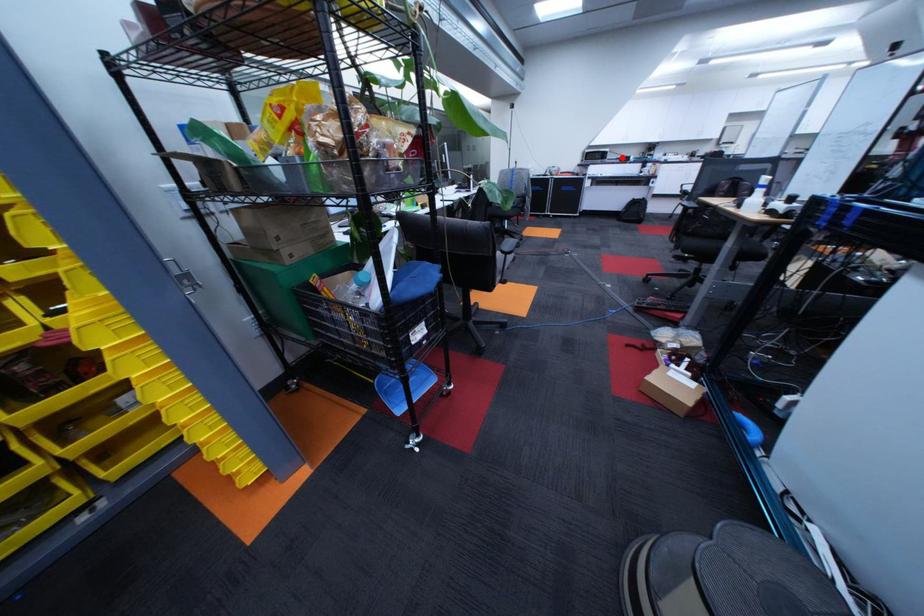
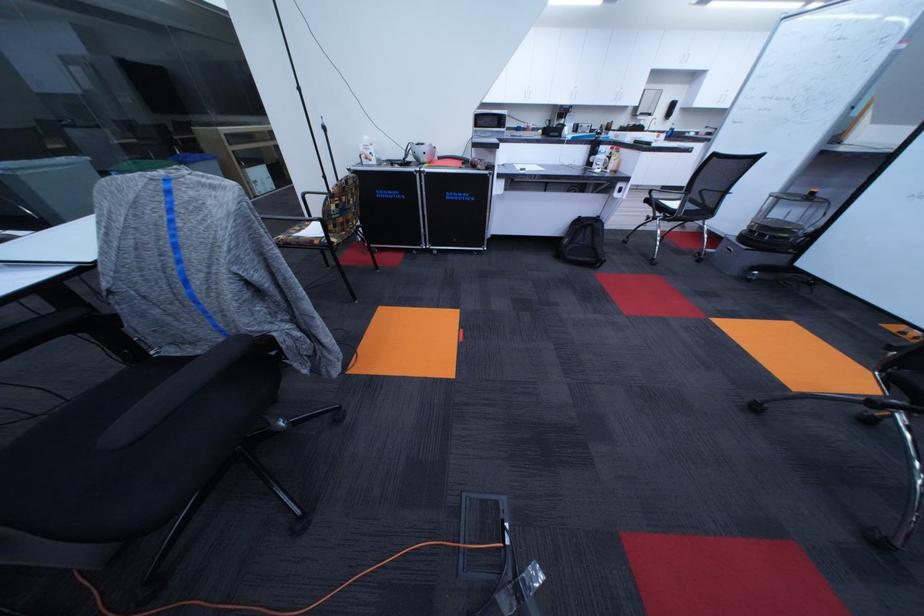
Question: I am providing you with two images of the same scene from different viewpoints. Given a red point in image1, look at the same physical point in image2. Is it:

Choices:
 (A) Closer to the viewpoint
 (B) Farther from the viewpoint

Answer: (B)